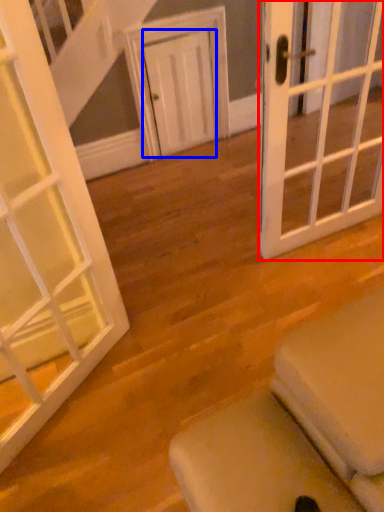
Question: Which point is closer to the camera, door (highlighted by a red box) or door (highlighted by a blue box)?

Choices:
 (A) door
 (B) door

Answer: (A)